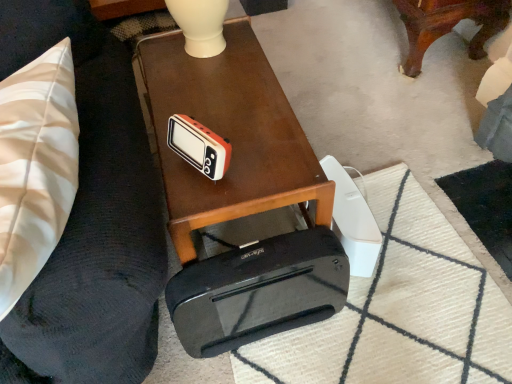
Question: Is black plastic cassette at lower center positioned in front of orange matte clock at center?

Choices:
 (A) yes
 (B) no

Answer: (B)

Question: Can we say black plastic cassette at lower center lies outside orange matte clock at center?

Choices:
 (A) yes
 (B) no

Answer: (A)

Question: From the image's perspective, is black plastic cassette at lower center below orange matte clock at center?

Choices:
 (A) yes
 (B) no

Answer: (A)

Question: Considering the relative sizes of black plastic cassette at lower center and orange matte clock at center in the image provided, is black plastic cassette at lower center taller than orange matte clock at center?

Choices:
 (A) no
 (B) yes

Answer: (B)

Question: Are black plastic cassette at lower center and orange matte clock at center beside each other?

Choices:
 (A) yes
 (B) no

Answer: (B)

Question: Which is correct: black plastic printer at lower center is inside black rubber mat at lower center, or outside of it?

Choices:
 (A) outside
 (B) inside

Answer: (A)

Question: From the image's perspective, is black plastic printer at lower center positioned above or below black rubber mat at lower center?

Choices:
 (A) above
 (B) below

Answer: (A)

Question: Considering the positions of black plastic printer at lower center and black rubber mat at lower center in the image, is black plastic printer at lower center taller or shorter than black rubber mat at lower center?

Choices:
 (A) tall
 (B) short

Answer: (A)

Question: Considering their positions, is black plastic printer at lower center located in front of or behind black rubber mat at lower center?

Choices:
 (A) behind
 (B) front

Answer: (B)

Question: Looking at the image, does wooden table at center seem bigger or smaller compared to black plastic printer at lower center?

Choices:
 (A) big
 (B) small

Answer: (B)

Question: From the image's perspective, is wooden table at center above or below black plastic printer at lower center?

Choices:
 (A) below
 (B) above

Answer: (B)

Question: Choose the correct answer: Is wooden table at center inside black plastic printer at lower center or outside it?

Choices:
 (A) outside
 (B) inside

Answer: (A)

Question: Is wooden table at center to the left or to the right of black plastic printer at lower center in the image?

Choices:
 (A) left
 (B) right

Answer: (B)

Question: Would you say orange matte clock at center is inside or outside wooden table at center?

Choices:
 (A) inside
 (B) outside

Answer: (B)

Question: Considering the positions of orange matte clock at center and wooden table at center in the image, is orange matte clock at center wider or thinner than wooden table at center?

Choices:
 (A) thin
 (B) wide

Answer: (A)